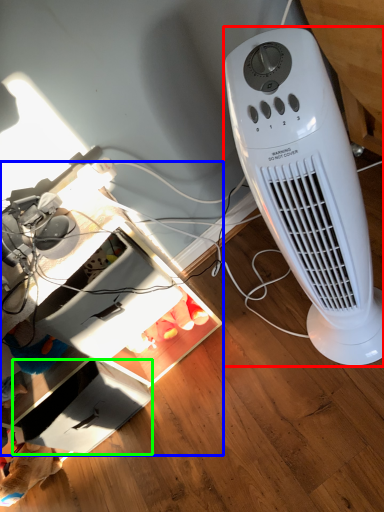
Question: Which is farther away from home appliance (highlighted by a red box)? computer desk (highlighted by a blue box) or drawer (highlighted by a green box)?

Choices:
 (A) computer desk
 (B) drawer

Answer: (B)